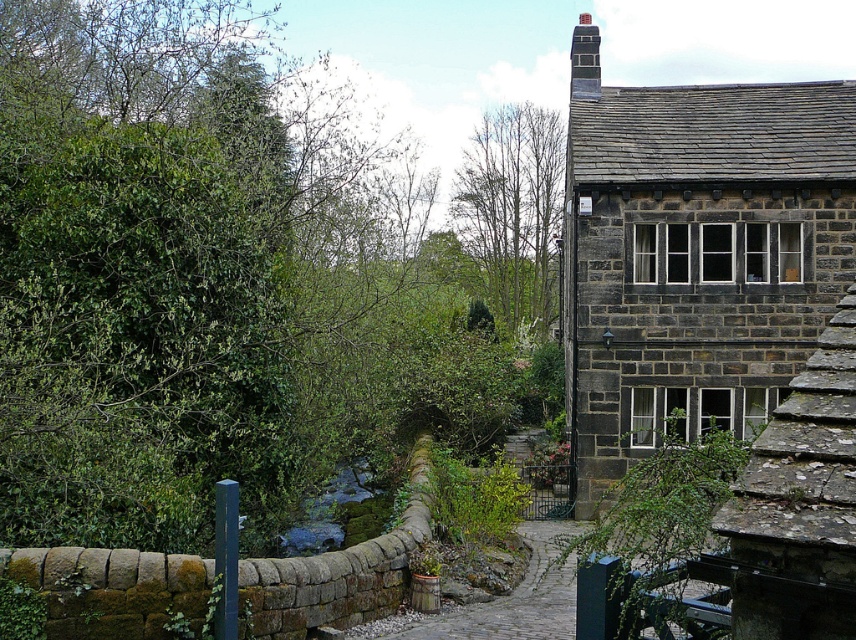
Question: Does green mossy stone at center have a smaller size compared to smooth brick chimney at upper right?

Choices:
 (A) yes
 (B) no

Answer: (A)

Question: Can you confirm if green leafy tree at upper center is thinner than green mossy stone at center?

Choices:
 (A) no
 (B) yes

Answer: (A)

Question: Which point is farther to the camera?

Choices:
 (A) green leafy tree at upper left
 (B) green leafy tree at upper center
 (C) smooth brick chimney at upper right

Answer: (B)

Question: Which point appears closest to the camera in this image?

Choices:
 (A) (551, 259)
 (B) (322, 499)
 (C) (302, 337)

Answer: (C)

Question: Does green leafy tree at upper center have a larger size compared to green mossy stone at center?

Choices:
 (A) yes
 (B) no

Answer: (A)

Question: Which point is farther from the camera taking this photo?

Choices:
 (A) (580, 17)
 (B) (314, 552)

Answer: (A)